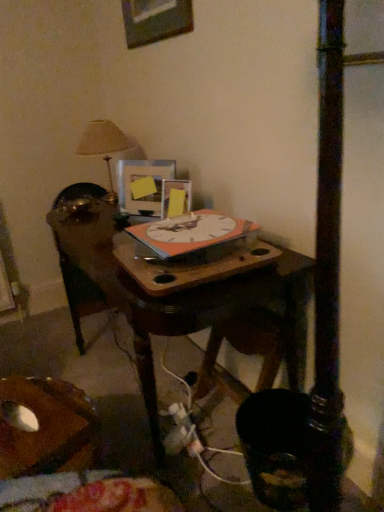
Question: Should I look upward or downward to see wooden picture frame at upper center, marked as the first picture frame in a top-to-bottom arrangement?

Choices:
 (A) up
 (B) down

Answer: (A)

Question: From the image's perspective, is orange matte clock at center under matte beige lampshade at upper left?

Choices:
 (A) no
 (B) yes

Answer: (B)

Question: Is orange matte clock at center facing away from matte beige lampshade at upper left?

Choices:
 (A) yes
 (B) no

Answer: (B)

Question: Does orange matte clock at center have a smaller size compared to matte beige lampshade at upper left?

Choices:
 (A) no
 (B) yes

Answer: (B)

Question: Is orange matte clock at center not inside matte beige lampshade at upper left?

Choices:
 (A) no
 (B) yes

Answer: (B)

Question: Can you confirm if orange matte clock at center is taller than matte beige lampshade at upper left?

Choices:
 (A) no
 (B) yes

Answer: (A)

Question: From a real-world perspective, is orange matte clock at center physically above matte beige lampshade at upper left?

Choices:
 (A) yes
 (B) no

Answer: (B)

Question: Does matte plastic picture frame at center, the 2th picture frame in the top-to-bottom sequence, contain matte beige lampshade at upper left?

Choices:
 (A) yes
 (B) no

Answer: (B)

Question: Is matte plastic picture frame at center, which is the second picture frame from bottom to top, wider than matte beige lampshade at upper left?

Choices:
 (A) no
 (B) yes

Answer: (A)

Question: Is matte plastic picture frame at center, the 2th picture frame in the top-to-bottom sequence, outside matte beige lampshade at upper left?

Choices:
 (A) yes
 (B) no

Answer: (A)

Question: Can you confirm if matte plastic picture frame at center, which is the second picture frame from bottom to top, is thinner than matte beige lampshade at upper left?

Choices:
 (A) no
 (B) yes

Answer: (B)

Question: Is matte plastic picture frame at center, the 2th picture frame in the top-to-bottom sequence, placed right next to matte beige lampshade at upper left?

Choices:
 (A) no
 (B) yes

Answer: (A)

Question: From a real-world perspective, does matte plastic picture frame at center, which is the second picture frame from bottom to top, stand above matte beige lampshade at upper left?

Choices:
 (A) no
 (B) yes

Answer: (A)

Question: Is white plastic plug at lower center positioned behind matte plastic picture frame at center, the 2th picture frame in the top-to-bottom sequence?

Choices:
 (A) yes
 (B) no

Answer: (B)